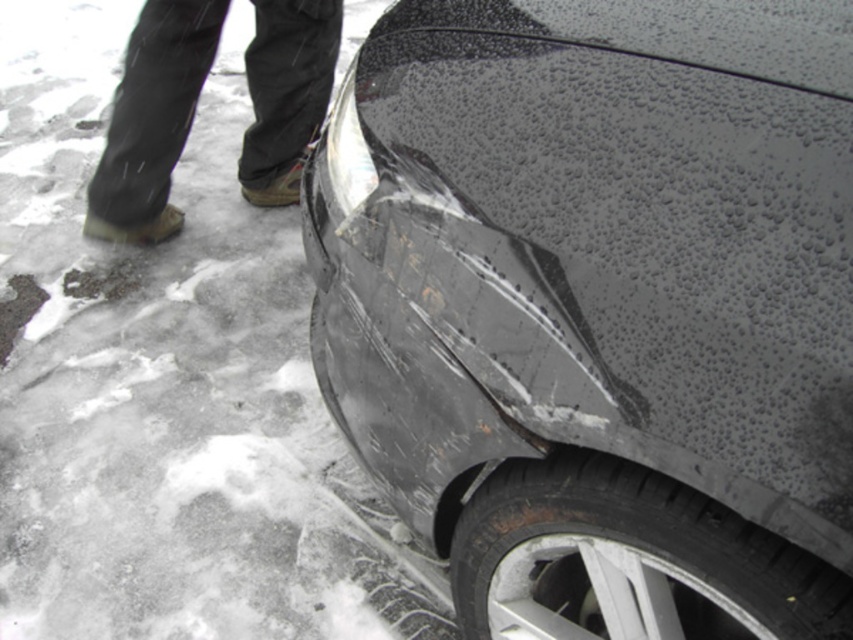
Based on the photo, you are a mechanic inspecting a damaged car. You notice a point marked at coordinates [628,561]. Based on the scene, what object is located at that point?

The point at [628,561] indicates the black rubber tire at lower right.

You are a mechanic inspecting a damaged car. You notice the black rubber tire at lower right and the black fabric pants at upper left. Which object is taller in the image?

The black fabric pants at upper left are taller than the black rubber tire at lower right.